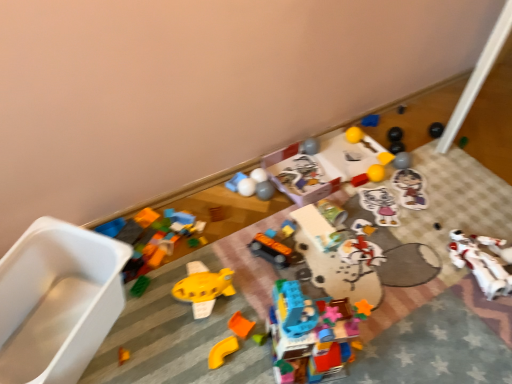
Identify the location of free space between white plastic robot at lower right, the first toy positioned from the right, and orange matte block at center, which ranks as the fifth toy in left-to-right order. (399, 286).